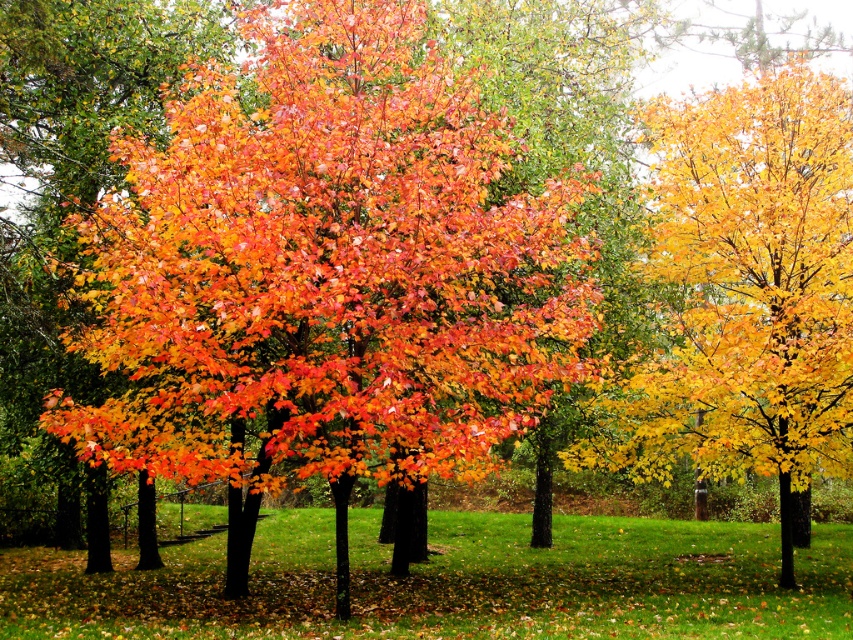
Is shiny orange leaves at center taller than golden yellow leaves at right?

No.

Does point (434, 52) come in front of point (714, 102)?

Yes.

Measure the distance between shiny orange leaves at center and camera.

They are 47.01 feet apart.

The width and height of the screenshot is (853, 640). Identify the location of shiny orange leaves at center. (326, 273).